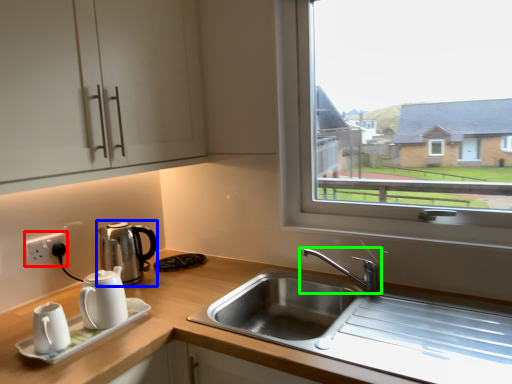
Question: Based on their relative distances, which object is nearer to electric outlet (highlighted by a red box)? Choose from coffeepot (highlighted by a blue box) and tap (highlighted by a green box).

Choices:
 (A) coffeepot
 (B) tap

Answer: (A)